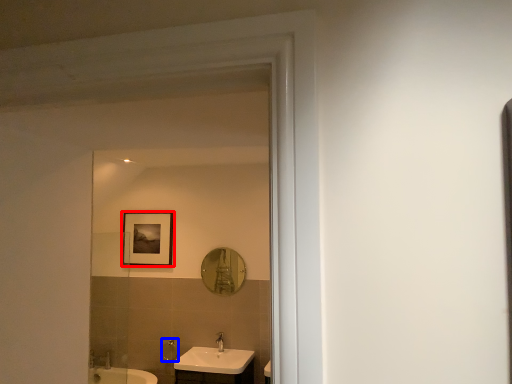
Question: Which object is closer to the camera taking this photo, picture frame (highlighted by a red box) or shower (highlighted by a blue box)?

Choices:
 (A) picture frame
 (B) shower

Answer: (B)